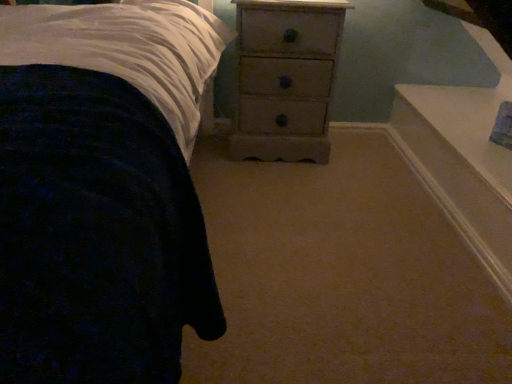
This screenshot has width=512, height=384. In order to click on vacant space in front of light brown wooden chest of drawers at center in this screenshot , I will do `click(283, 190)`.